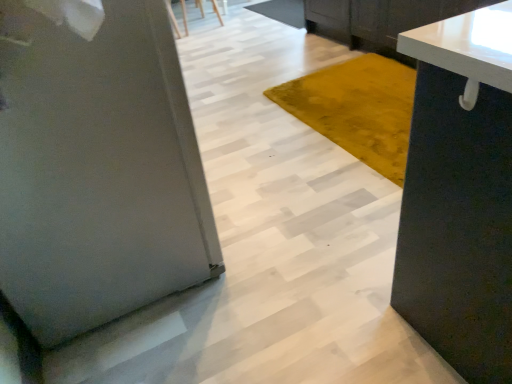
Describe the element at coordinates (97, 170) in the screenshot. I see `satin silver refrigerator at left` at that location.

What is the approximate width of white glossy countertop at upper right?

The width of white glossy countertop at upper right is 24.95 inches.

Identify the location of matte black cabinet at right. This screenshot has width=512, height=384. (460, 194).

From the image's perspective, who appears lower, satin silver refrigerator at left or wooden chair at upper center?

From the image's view, satin silver refrigerator at left is below.

Considering the positions of objects satin silver refrigerator at left and wooden chair at upper center in the image provided, who is more to the right, satin silver refrigerator at left or wooden chair at upper center?

wooden chair at upper center.

From a real-world perspective, is satin silver refrigerator at left above or below wooden chair at upper center?

Clearly, from a real-world perspective, satin silver refrigerator at left is above wooden chair at upper center.

Consider the image. Is matte black cabinet at right not close to satin silver refrigerator at left?

Actually, matte black cabinet at right and satin silver refrigerator at left are a little close together.

Consider the image. From the image's perspective, who appears lower, matte black cabinet at right or satin silver refrigerator at left?

From the image's view, matte black cabinet at right is below.

Which object is positioned more to the left, matte black cabinet at right or satin silver refrigerator at left?

satin silver refrigerator at left is more to the left.

How many degrees apart are the facing directions of wooden chair at upper center and matte black cabinet at right?

1.21 degrees.

From the image's perspective, is wooden chair at upper center beneath matte black cabinet at right?

Incorrect, from the image's perspective, wooden chair at upper center is higher than matte black cabinet at right.

Is wooden chair at upper center next to matte black cabinet at right?

No, wooden chair at upper center is not next to matte black cabinet at right.

Is wooden chair at upper center bigger or smaller than matte black cabinet at right?

wooden chair at upper center is smaller than matte black cabinet at right.

Between satin silver refrigerator at left and white glossy countertop at upper right, which one appears on the left side from the viewer's perspective?

Positioned to the left is satin silver refrigerator at left.

Is satin silver refrigerator at left aimed at white glossy countertop at upper right?

Yes, satin silver refrigerator at left is oriented towards white glossy countertop at upper right.

Which of these two, satin silver refrigerator at left or white glossy countertop at upper right, is smaller?

white glossy countertop at upper right.

Looking at this image, from the image's perspective, is white glossy countertop at upper right above satin silver refrigerator at left?

Yes, from the image's perspective, white glossy countertop at upper right is above satin silver refrigerator at left.

Is white glossy countertop at upper right aimed at satin silver refrigerator at left?

Yes, white glossy countertop at upper right is facing satin silver refrigerator at left.

Can you tell me how much white glossy countertop at upper right and satin silver refrigerator at left differ in facing direction?

The angular difference between white glossy countertop at upper right and satin silver refrigerator at left is 179 degrees.

At what (x,y) coordinates should I click in order to perform the action: click on pillar that is above the white glossy countertop at upper right (from a real-world perspective). Please return your answer as a coordinate pair (x, y). The image size is (512, 384). Looking at the image, I should click on (97, 170).

Looking at the image, does matte black cabinet at right seem bigger or smaller compared to white glossy countertop at upper right?

In the image, matte black cabinet at right appears to be smaller than white glossy countertop at upper right.

From a real-world perspective, between matte black cabinet at right and white glossy countertop at upper right, who is vertically higher?

matte black cabinet at right is physically above.

From the image's perspective, which is above, matte black cabinet at right or white glossy countertop at upper right?

white glossy countertop at upper right is shown above in the image.

Can you confirm if matte black cabinet at right is positioned to the right of white glossy countertop at upper right?

Incorrect, matte black cabinet at right is not on the right side of white glossy countertop at upper right.

From a real-world perspective, who is located lower, white glossy countertop at upper right or wooden chair at upper center?

wooden chair at upper center is physically lower.

How many degrees apart are the facing directions of white glossy countertop at upper right and wooden chair at upper center?

The angle between the facing direction of white glossy countertop at upper right and the facing direction of wooden chair at upper center is 89.1 degrees.

Can you confirm if white glossy countertop at upper right is bigger than wooden chair at upper center?

Indeed, white glossy countertop at upper right has a larger size compared to wooden chair at upper center.

Which of these two, white glossy countertop at upper right or wooden chair at upper center, stands taller?

white glossy countertop at upper right is taller.

This screenshot has height=384, width=512. I want to click on chair behind the satin silver refrigerator at left, so click(173, 19).

What are the coordinates of `pillar that is above the matte black cabinet at right (from the image's perspective)` in the screenshot? It's located at (97, 170).

Which object lies further to the anchor point matte black cabinet at right, wooden chair at upper center or white glossy countertop at upper right?

Based on the image, wooden chair at upper center appears to be further to matte black cabinet at right.

From the image, which object appears to be farther from wooden chair at upper center, satin silver refrigerator at left or white glossy countertop at upper right?

white glossy countertop at upper right is positioned further to the anchor wooden chair at upper center.

When comparing their distances from white glossy countertop at upper right, does satin silver refrigerator at left or matte black cabinet at right seem closer?

Among the two, matte black cabinet at right is located nearer to white glossy countertop at upper right.

Estimate the real-world distances between objects in this image. Which object is further from white glossy countertop at upper right, matte black cabinet at right or wooden chair at upper center?

Based on the image, wooden chair at upper center appears to be further to white glossy countertop at upper right.

Which object lies further to the anchor point satin silver refrigerator at left, white glossy countertop at upper right or wooden chair at upper center?

wooden chair at upper center.

Based on their spatial positions, is white glossy countertop at upper right or matte black cabinet at right closer to wooden chair at upper center?

white glossy countertop at upper right.

From the image, which object appears to be nearer to matte black cabinet at right, wooden chair at upper center or satin silver refrigerator at left?

The object closer to matte black cabinet at right is satin silver refrigerator at left.

Looking at the image, which one is located closer to wooden chair at upper center, matte black cabinet at right or satin silver refrigerator at left?

satin silver refrigerator at left lies closer to wooden chair at upper center than the other object.

Identify the location of countertop between satin silver refrigerator at left and wooden chair at upper center along the z-axis. (467, 45).

Locate an element on the screen. cabinetry between satin silver refrigerator at left and white glossy countertop at upper right in the horizontal direction is located at coordinates (460, 194).

The height and width of the screenshot is (384, 512). Find the location of `countertop between matte black cabinet at right and wooden chair at upper center in the front-back direction`. countertop between matte black cabinet at right and wooden chair at upper center in the front-back direction is located at coordinates (467, 45).

Locate an element on the screen. This screenshot has height=384, width=512. pillar between matte black cabinet at right and wooden chair at upper center along the z-axis is located at coordinates (97, 170).